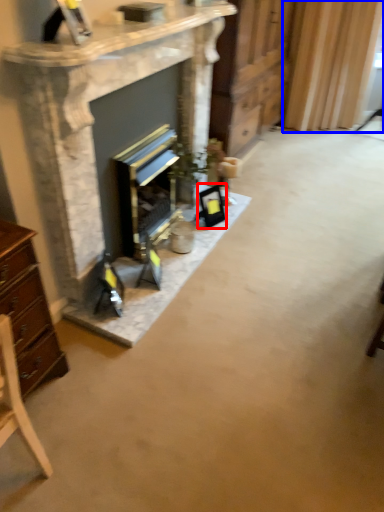
Question: Which object is further to the camera taking this photo, picture frame (highlighted by a red box) or curtain (highlighted by a blue box)?

Choices:
 (A) picture frame
 (B) curtain

Answer: (B)